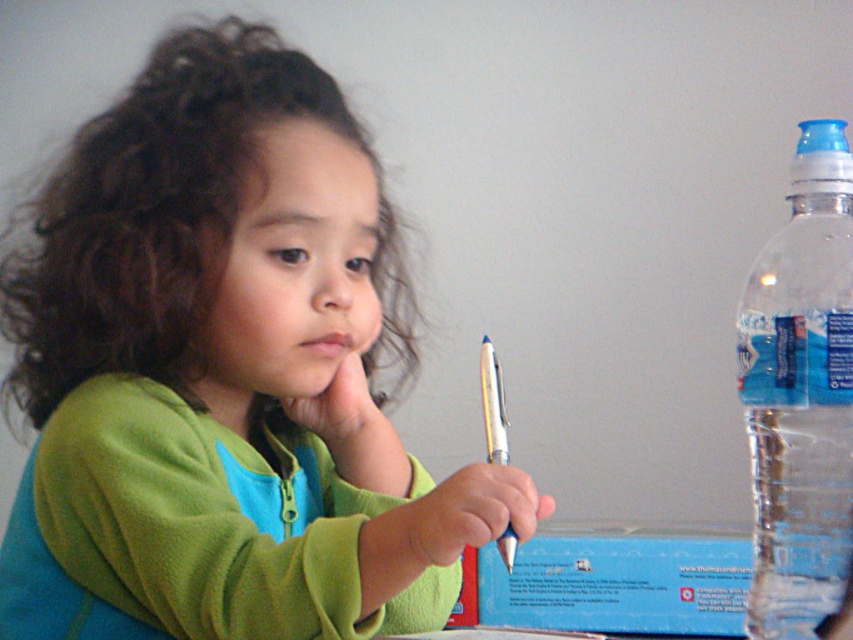
Between point (758, 294) and point (486, 445), which one is positioned in front?

Point (758, 294)

Can you confirm if transparent plastic bottle at right is bigger than metallic blue pen at center?

Indeed, transparent plastic bottle at right has a larger size compared to metallic blue pen at center.

The height and width of the screenshot is (640, 853). Find the location of `transparent plastic bottle at right`. transparent plastic bottle at right is located at coordinates (801, 394).

Is green fleece jacket at center shorter than transparent plastic bottle at right?

No.

Between point (206, 216) and point (763, 467), which one is positioned behind?

Positioned behind is point (763, 467).

Where is `green fleece jacket at center`? green fleece jacket at center is located at coordinates (224, 372).

Is green fleece jacket at center taller than metallic blue pen at center?

Indeed, green fleece jacket at center has a greater height compared to metallic blue pen at center.

Is point (163, 163) positioned in front of point (506, 561)?

No.

The image size is (853, 640). What are the coordinates of `green fleece jacket at center` in the screenshot? It's located at (224, 372).

The height and width of the screenshot is (640, 853). Identify the location of green fleece jacket at center. (224, 372).